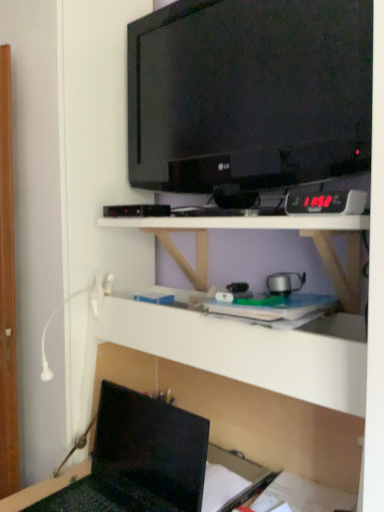
Locate an element on the screen. black glossy tv at upper center is located at coordinates (249, 93).

What do you see at coordinates (248, 417) in the screenshot? The image size is (384, 512). I see `white matte shelf at center, the first shelf positioned from the bottom` at bounding box center [248, 417].

You are a GUI agent. You are given a task and a screenshot of the screen. Output one action in this format:
    pyautogui.click(x=<x>, y=<y>)
    Task: Click on the black glossy tv at upper center
    The image size is (384, 512).
    Given the screenshot: What is the action you would take?
    pyautogui.click(x=249, y=93)

At what (x,y) coordinates should I click in order to perform the action: click on laptop below the black glossy tv at upper center (from a real-world perspective). Please return your answer as a coordinate pair (x, y). This screenshot has height=512, width=384. Looking at the image, I should click on (139, 459).

Considering the relative sizes of matte black laptop at lower left and black glossy tv at upper center in the image provided, is matte black laptop at lower left shorter than black glossy tv at upper center?

Yes, matte black laptop at lower left is shorter than black glossy tv at upper center.

Considering the sizes of matte black laptop at lower left and black glossy tv at upper center in the image, is matte black laptop at lower left wider or thinner than black glossy tv at upper center?

Clearly, matte black laptop at lower left has more width compared to black glossy tv at upper center.

Would you consider matte black laptop at lower left to be distant from black glossy tv at upper center?

No.

Based on the photo, is black glossy tv at upper center oriented towards white matte shelf at center, the first shelf positioned from the bottom?

No, black glossy tv at upper center is not facing towards white matte shelf at center, the first shelf positioned from the bottom.

Considering the sizes of objects black glossy tv at upper center and white matte shelf at center, arranged as the 2th shelf when viewed from the top, in the image provided, who is bigger, black glossy tv at upper center or white matte shelf at center, arranged as the 2th shelf when viewed from the top,?

white matte shelf at center, arranged as the 2th shelf when viewed from the top, is bigger.

Where is `television behind the white matte shelf at center, arranged as the 2th shelf when viewed from the top`? Image resolution: width=384 pixels, height=512 pixels. television behind the white matte shelf at center, arranged as the 2th shelf when viewed from the top is located at coordinates (249, 93).

Based on the photo, is black glossy tv at upper center further to the viewer compared to white matte shelf at center, arranged as the 2th shelf when viewed from the top?

That is True.

Locate an element on the screen. The image size is (384, 512). television on the right of matte black laptop at lower left is located at coordinates (249, 93).

Is black glossy tv at upper center positioned beyond the bounds of matte black laptop at lower left?

Indeed, black glossy tv at upper center is completely outside matte black laptop at lower left.

Measure the distance from black glossy tv at upper center to matte black laptop at lower left.

A distance of 81.29 centimeters exists between black glossy tv at upper center and matte black laptop at lower left.

Considering the relative sizes of white matte shelf at center, the first shelf positioned from the bottom, and matte black laptop at lower left in the image provided, is white matte shelf at center, the first shelf positioned from the bottom, taller than matte black laptop at lower left?

Yes, white matte shelf at center, the first shelf positioned from the bottom, is taller than matte black laptop at lower left.

From the image's perspective, would you say white matte shelf at center, arranged as the 2th shelf when viewed from the top, is positioned over matte black laptop at lower left?

No, from the image's perspective, white matte shelf at center, arranged as the 2th shelf when viewed from the top, is not above matte black laptop at lower left.

Does white matte shelf at center, the first shelf positioned from the bottom, appear on the right side of matte black laptop at lower left?

Yes.

Is point (314, 445) positioned after point (185, 412)?

Yes, point (314, 445) is behind point (185, 412).

Is black glossy tv at upper center a part of white matte shelf at center, the first shelf positioned from the bottom?

No.

How distant is white matte shelf at center, arranged as the 2th shelf when viewed from the top, from black glossy tv at upper center?

white matte shelf at center, arranged as the 2th shelf when viewed from the top, is 30.01 inches from black glossy tv at upper center.

Is white matte shelf at center, arranged as the 2th shelf when viewed from the top, positioned with its back to black glossy tv at upper center?

No, white matte shelf at center, arranged as the 2th shelf when viewed from the top, is not facing the opposite direction of black glossy tv at upper center.

Who is more distant, white matte shelf at center, the first shelf positioned from the bottom, or black glossy tv at upper center?

black glossy tv at upper center.

Which object is positioned more to the left, white matte shelf at center, the second shelf positioned from the bottom, or white matte shelf at center, the first shelf positioned from the bottom?

white matte shelf at center, the first shelf positioned from the bottom, is more to the left.

Considering the sizes of objects white matte shelf at center, which ranks as the first shelf in top-to-bottom order, and white matte shelf at center, the first shelf positioned from the bottom, in the image provided, who is shorter, white matte shelf at center, which ranks as the first shelf in top-to-bottom order, or white matte shelf at center, the first shelf positioned from the bottom,?

white matte shelf at center, which ranks as the first shelf in top-to-bottom order, is shorter.

Considering the sizes of objects white matte shelf at center, the second shelf positioned from the bottom, and white matte shelf at center, the first shelf positioned from the bottom, in the image provided, who is bigger, white matte shelf at center, the second shelf positioned from the bottom, or white matte shelf at center, the first shelf positioned from the bottom,?

With larger size is white matte shelf at center, the first shelf positioned from the bottom.

Is white matte shelf at center, the second shelf positioned from the bottom, turned away from white matte shelf at center, the first shelf positioned from the bottom?

No, white matte shelf at center, the second shelf positioned from the bottom, is not facing the opposite direction of white matte shelf at center, the first shelf positioned from the bottom.

Considering the relative positions of white matte shelf at center, the second shelf positioned from the bottom, and matte black laptop at lower left in the image provided, is white matte shelf at center, the second shelf positioned from the bottom, to the left or to the right of matte black laptop at lower left?

Based on their positions, white matte shelf at center, the second shelf positioned from the bottom, is located to the right of matte black laptop at lower left.

Does point (317, 221) come closer to viewer compared to point (160, 511)?

Yes, it is in front of point (160, 511).

From a real-world perspective, does white matte shelf at center, which ranks as the first shelf in top-to-bottom order, stand above matte black laptop at lower left?

Yes, from a real-world perspective, white matte shelf at center, which ranks as the first shelf in top-to-bottom order, is over matte black laptop at lower left

Who is smaller, white matte shelf at center, which ranks as the first shelf in top-to-bottom order, or matte black laptop at lower left?

With smaller size is matte black laptop at lower left.

This screenshot has width=384, height=512. What are the coordinates of `laptop in front of the black glossy tv at upper center` in the screenshot? It's located at (139, 459).

Where is `television on the right of white matte shelf at center, the first shelf positioned from the bottom`? television on the right of white matte shelf at center, the first shelf positioned from the bottom is located at coordinates (249, 93).

From the image, which object appears to be nearer to white matte shelf at center, which ranks as the first shelf in top-to-bottom order, black glossy tv at upper center or matte black laptop at lower left?

black glossy tv at upper center is positioned closer to the anchor white matte shelf at center, which ranks as the first shelf in top-to-bottom order.

When comparing their distances from black glossy tv at upper center, does matte black laptop at lower left or white matte shelf at center, the second shelf positioned from the bottom, seem further?

The object further to black glossy tv at upper center is matte black laptop at lower left.

Which object lies nearer to the anchor point matte black laptop at lower left, white matte shelf at center, which ranks as the first shelf in top-to-bottom order, or black glossy tv at upper center?

white matte shelf at center, which ranks as the first shelf in top-to-bottom order, is positioned closer to the anchor matte black laptop at lower left.

Based on their spatial positions, is white matte shelf at center, which ranks as the first shelf in top-to-bottom order, or matte black laptop at lower left closer to white matte shelf at center, the first shelf positioned from the bottom?

matte black laptop at lower left.

From the image, which object appears to be nearer to black glossy tv at upper center, matte black laptop at lower left or white matte shelf at center, arranged as the 2th shelf when viewed from the top?

white matte shelf at center, arranged as the 2th shelf when viewed from the top.

Which object lies further to the anchor point white matte shelf at center, the first shelf positioned from the bottom, black glossy tv at upper center or white matte shelf at center, which ranks as the first shelf in top-to-bottom order?

Based on the image, black glossy tv at upper center appears to be further to white matte shelf at center, the first shelf positioned from the bottom.

From the image, which object appears to be nearer to white matte shelf at center, the second shelf positioned from the bottom, white matte shelf at center, the first shelf positioned from the bottom, or matte black laptop at lower left?

The object closer to white matte shelf at center, the second shelf positioned from the bottom, is white matte shelf at center, the first shelf positioned from the bottom.

Based on their spatial positions, is white matte shelf at center, the second shelf positioned from the bottom, or white matte shelf at center, the first shelf positioned from the bottom, further from black glossy tv at upper center?

white matte shelf at center, the first shelf positioned from the bottom, is further to black glossy tv at upper center.

You are a GUI agent. You are given a task and a screenshot of the screen. Output one action in this format:
    pyautogui.click(x=<x>, y=<y>)
    Task: Click on the shelf between black glossy tv at upper center and matte black laptop at lower left from top to bottom
    Image resolution: width=384 pixels, height=512 pixels.
    Given the screenshot: What is the action you would take?
    pyautogui.click(x=264, y=229)

Identify the location of laptop between white matte shelf at center, the second shelf positioned from the bottom, and white matte shelf at center, arranged as the 2th shelf when viewed from the top, in the up-down direction. The height and width of the screenshot is (512, 384). (139, 459).

This screenshot has width=384, height=512. In order to click on shelf between black glossy tv at upper center and white matte shelf at center, arranged as the 2th shelf when viewed from the top, vertically in this screenshot , I will do `click(264, 229)`.

At what (x,y) coordinates should I click in order to perform the action: click on laptop between black glossy tv at upper center and white matte shelf at center, the first shelf positioned from the bottom, in the vertical direction. Please return your answer as a coordinate pair (x, y). This screenshot has width=384, height=512. Looking at the image, I should click on (139, 459).